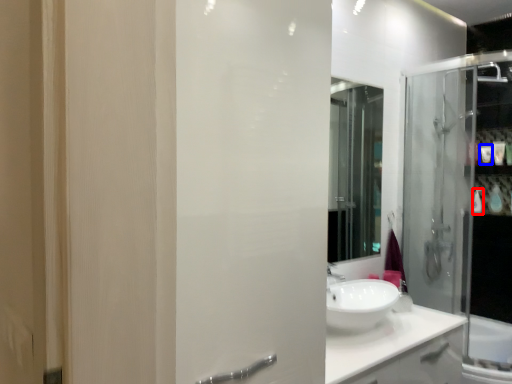
Question: Which point is closer to the camera, toiletry (highlighted by a red box) or toiletry (highlighted by a blue box)?

Choices:
 (A) toiletry
 (B) toiletry

Answer: (B)